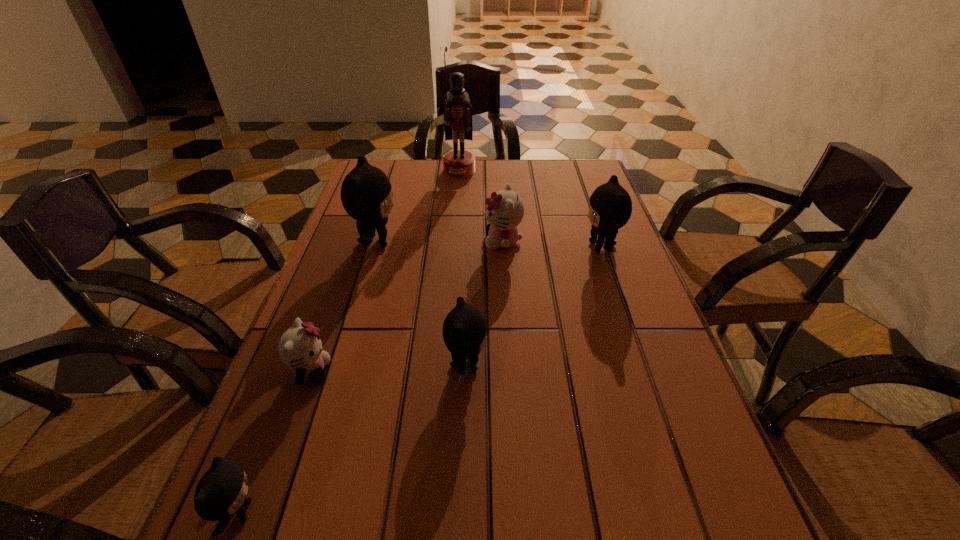
Where is `vacant area between the farthest object and the third smallest gray kitten`? vacant area between the farthest object and the third smallest gray kitten is located at coordinates (530, 208).

The image size is (960, 540). I want to click on free space between the red nutcracker and the tallest kitten, so click(x=418, y=206).

Locate which object ranks second in proximity to the second nearest gray kitten. Please provide its 2D coordinates. Your answer should be formatted as a tuple, i.e. [(x, y)], where the tuple contains the x and y coordinates of a point satisfying the conditions above.

[(366, 194)]

Select which object appears as the fourth closest to the nutcracker. Please provide its 2D coordinates. Your answer should be formatted as a tuple, i.e. [(x, y)], where the tuple contains the x and y coordinates of a point satisfying the conditions above.

[(464, 330)]

Locate an element on the screen. This screenshot has width=960, height=540. kitten that stands as the fourth closest to the second tallest object is located at coordinates (610, 206).

Identify which kitten is the third closest to the rightmost object. Please provide its 2D coordinates. Your answer should be formatted as a tuple, i.e. [(x, y)], where the tuple contains the x and y coordinates of a point satisfying the conditions above.

[(366, 194)]

Locate which gray kitten ranks third in proximity to the nearer white kitten. Please provide its 2D coordinates. Your answer should be formatted as a tuple, i.e. [(x, y)], where the tuple contains the x and y coordinates of a point satisfying the conditions above.

[(366, 194)]

Identify the location of gray kitten that is the second closest to the seventh shortest object. (610, 206).